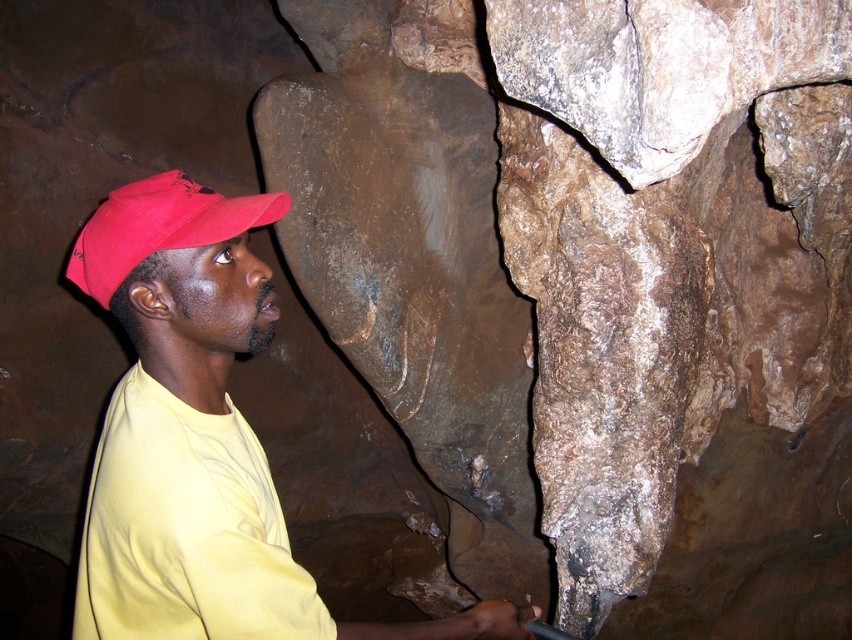
Question: Which point is farther to the camera?

Choices:
 (A) yellow matte shirt at center
 (B) matte red cap at left
 (C) brown rough rock at center

Answer: (C)

Question: Is brown rough rock at center positioned before matte red cap at left?

Choices:
 (A) yes
 (B) no

Answer: (B)

Question: Which object is the closest to the brown rough rock at center?

Choices:
 (A) yellow matte shirt at center
 (B) matte red cap at left

Answer: (A)

Question: Observing the image, what is the correct spatial positioning of yellow matte shirt at center in reference to matte red cap at left?

Choices:
 (A) right
 (B) left

Answer: (A)

Question: Based on their relative distances, which object is farther from the yellow matte shirt at center?

Choices:
 (A) matte red cap at left
 (B) brown rough rock at center

Answer: (B)

Question: Can you confirm if brown rough rock at center is positioned above yellow matte shirt at center?

Choices:
 (A) no
 (B) yes

Answer: (A)